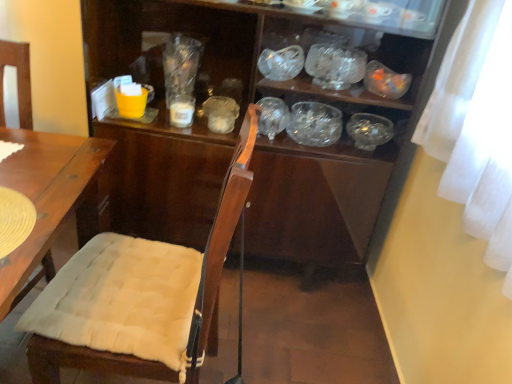
The image size is (512, 384). Describe the element at coordinates (153, 284) in the screenshot. I see `wooden chair cushion at center` at that location.

Describe the element at coordinates (131, 100) in the screenshot. I see `matte yellow cup at upper left, the fourth tableware from the right` at that location.

You are a GUI agent. You are given a task and a screenshot of the screen. Output one action in this format:
    pyautogui.click(x=<x>, y=<y>)
    Task: Click on the transparent plastic cup at upper center
    The image size is (512, 384).
    Given the screenshot: What is the action you would take?
    pyautogui.click(x=180, y=65)

Describe the element at coordinates (314, 124) in the screenshot. This screenshot has width=512, height=384. I see `transparent glass bowl at center, positioned as the 2th glass bowl in top-to-bottom order` at that location.

Where is `transparent glass bowl at upper center, positioned as the 2th glass bowl in bottom-to-top order`? transparent glass bowl at upper center, positioned as the 2th glass bowl in bottom-to-top order is located at coordinates (335, 66).

What do you see at coordinates (335, 66) in the screenshot? I see `transparent glass bowl at upper center, the 1th glass bowl in the top-to-bottom sequence` at bounding box center [335, 66].

Measure the distance between point (356, 130) and camera.

The distance of point (356, 130) from camera is 6.21 feet.

This screenshot has width=512, height=384. Identify the location of wooden chair cushion at center. (153, 284).

Which point is more forward, (292,131) or (183,42)?

The point (292,131) is in front.

Is transparent glass bowl at center, which ranks as the first glass bowl in bottom-to-top order, taller than transparent plastic cup at upper center?

In fact, transparent glass bowl at center, which ranks as the first glass bowl in bottom-to-top order, may be shorter than transparent plastic cup at upper center.

Choose the correct answer: Is transparent glass bowl at center, which ranks as the first glass bowl in bottom-to-top order, inside transparent plastic cup at upper center or outside it?

transparent glass bowl at center, which ranks as the first glass bowl in bottom-to-top order, is not enclosed by transparent plastic cup at upper center.

Is transparent glass bowl at center, positioned as the 2th glass bowl in top-to-bottom order, to the left of transparent plastic cup at upper center from the viewer's perspective?

No.

Based on the photo, from the image's perspective, which object appears higher, matte yellow cup at upper left, the fourth tableware from the right, or transparent glass bowl at center, which ranks as the first glass bowl in bottom-to-top order?

From the image's view, matte yellow cup at upper left, the fourth tableware from the right, is above.

How many degrees apart are the facing directions of matte yellow cup at upper left, which is the first tableware from left to right, and transparent glass bowl at center, which ranks as the first glass bowl in bottom-to-top order?

The angular difference between matte yellow cup at upper left, which is the first tableware from left to right, and transparent glass bowl at center, which ranks as the first glass bowl in bottom-to-top order, is 1.25 degrees.

Is point (115, 85) closer to viewer compared to point (309, 121)?

Yes, point (115, 85) is in front of point (309, 121).

Is matte yellow cup at upper left, which is the first tableware from left to right, beside transparent glass bowl at center, which ranks as the first glass bowl in bottom-to-top order?

They are not placed beside each other.

How many degrees apart are the facing directions of transparent plastic cup at upper center and wooden chair cushion at center?

They differ by 91.7 degrees in their facing directions.

Is transparent plastic cup at upper center not within wooden chair cushion at center?

Absolutely, transparent plastic cup at upper center is external to wooden chair cushion at center.

From a real-world perspective, who is located lower, transparent plastic cup at upper center or wooden chair cushion at center?

wooden chair cushion at center.

Is transparent plastic cup at upper center placed right next to wooden chair cushion at center?

No.

Can you confirm if wooden chair cushion at center is wider than transparent glass bowl at center, the 4th tableware from the left?

Correct, the width of wooden chair cushion at center exceeds that of transparent glass bowl at center, the 4th tableware from the left.

Which of these two, wooden chair cushion at center or transparent glass bowl at center, acting as the first tableware starting from the right, stands taller?

With more height is wooden chair cushion at center.

How different are the orientations of wooden chair cushion at center and transparent glass bowl at center, acting as the first tableware starting from the right, in degrees?

The angular difference between wooden chair cushion at center and transparent glass bowl at center, acting as the first tableware starting from the right, is 89 degrees.

From the picture: From a real-world perspective, who is located higher, wooden chair cushion at center or transparent glass bowl at center, the 4th tableware from the left?

From a 3D spatial view, transparent glass bowl at center, the 4th tableware from the left, is above.

Is white glossy cup at center, the 2th tableware positioned from the left, far away from transparent glass bowl at center, acting as the first tableware starting from the right?

No.

Between white glossy cup at center, the 3th tableware when ordered from right to left, and transparent glass bowl at center, the 4th tableware from the left, which one has smaller width?

white glossy cup at center, the 3th tableware when ordered from right to left.

Is white glossy cup at center, the 3th tableware when ordered from right to left, at the left side of transparent glass bowl at center, acting as the first tableware starting from the right?

Yes.

Is white glossy cup at center, the 2th tableware positioned from the left, inside the boundaries of transparent glass bowl at center, acting as the first tableware starting from the right, or outside?

white glossy cup at center, the 2th tableware positioned from the left, is outside transparent glass bowl at center, acting as the first tableware starting from the right.

Is clear glass bowl at upper center, which is the second tableware from right to left, touching white glossy cup at center, the 3th tableware when ordered from right to left?

They are not placed beside each other.

Is clear glass bowl at upper center, the 3th tableware viewed from the left, not inside white glossy cup at center, the 2th tableware positioned from the left?

Yes.

In the scene shown: Relative to white glossy cup at center, the 3th tableware when ordered from right to left, is clear glass bowl at upper center, which is the second tableware from right to left, in front or behind?

clear glass bowl at upper center, which is the second tableware from right to left, is positioned closer to the viewer than white glossy cup at center, the 3th tableware when ordered from right to left.

Is clear glass bowl at upper center, the 3th tableware viewed from the left, taller or shorter than white glossy cup at center, the 2th tableware positioned from the left?

clear glass bowl at upper center, the 3th tableware viewed from the left, is taller than white glossy cup at center, the 2th tableware positioned from the left.

From the image's perspective, is transparent plastic cup at upper center located above or below clear glass bowl at upper center, which is the second tableware from right to left?

Based on their image positions, transparent plastic cup at upper center is located beneath clear glass bowl at upper center, which is the second tableware from right to left.

Considering the positions of point (167, 64) and point (278, 71), is point (167, 64) closer or farther from the camera than point (278, 71)?

Clearly, point (167, 64) is more distant from the camera than point (278, 71).

How far apart are transparent plastic cup at upper center and clear glass bowl at upper center, the 3th tableware viewed from the left?

They are 14.50 inches apart.

Identify the location of glass jar located underneath the clear glass bowl at upper center, which is the second tableware from right to left (from a real-world perspective). (180, 65).

From the image's perspective, starting from the transparent plastic cup at upper center, which glass bowl is the 2nd one below? Please provide its 2D coordinates.

[(314, 124)]

Identify the location of glass bowl located behind the matte yellow cup at upper left, the fourth tableware from the right. The height and width of the screenshot is (384, 512). (314, 124).

From the image, which object appears to be farther from matte yellow cup at upper left, the fourth tableware from the right, wooden chair cushion at center or transparent plastic cup at upper center?

wooden chair cushion at center is positioned further to the anchor matte yellow cup at upper left, the fourth tableware from the right.

Based on their spatial positions, is wooden chair cushion at center or transparent glass bowl at upper center, the 1th glass bowl in the top-to-bottom sequence, closer to transparent glass bowl at center, the 4th tableware from the left?

transparent glass bowl at upper center, the 1th glass bowl in the top-to-bottom sequence, is closer to transparent glass bowl at center, the 4th tableware from the left.

Considering their positions, is transparent glass bowl at center, which ranks as the first glass bowl in bottom-to-top order, positioned further to transparent glass bowl at upper center, positioned as the 2th glass bowl in bottom-to-top order, than clear glass bowl at upper center, the 3th tableware viewed from the left?

Based on the image, transparent glass bowl at center, which ranks as the first glass bowl in bottom-to-top order, appears to be further to transparent glass bowl at upper center, positioned as the 2th glass bowl in bottom-to-top order.

Which object lies nearer to the anchor point transparent glass bowl at center, which ranks as the first glass bowl in bottom-to-top order, matte yellow cup at upper left, the fourth tableware from the right, or white glossy cup at center, the 3th tableware when ordered from right to left?

white glossy cup at center, the 3th tableware when ordered from right to left, is closer to transparent glass bowl at center, which ranks as the first glass bowl in bottom-to-top order.

Based on their spatial positions, is transparent glass bowl at center, the 4th tableware from the left, or transparent glass bowl at upper center, positioned as the 2th glass bowl in bottom-to-top order, further from transparent plastic cup at upper center?

Among the two, transparent glass bowl at center, the 4th tableware from the left, is located further to transparent plastic cup at upper center.

Consider the image. From the image, which object appears to be nearer to wooden chair cushion at center, transparent glass bowl at center, the 4th tableware from the left, or white glossy cup at center, the 2th tableware positioned from the left?

white glossy cup at center, the 2th tableware positioned from the left, lies closer to wooden chair cushion at center than the other object.

Which object lies nearer to the anchor point transparent glass bowl at center, positioned as the 2th glass bowl in top-to-bottom order, white glossy cup at center, the 2th tableware positioned from the left, or wooden chair cushion at center?

Among the two, white glossy cup at center, the 2th tableware positioned from the left, is located nearer to transparent glass bowl at center, positioned as the 2th glass bowl in top-to-bottom order.

From the image, which object appears to be nearer to transparent plastic cup at upper center, matte yellow cup at upper left, which is the first tableware from left to right, or transparent glass bowl at center, positioned as the 2th glass bowl in top-to-bottom order?

Among the two, matte yellow cup at upper left, which is the first tableware from left to right, is located nearer to transparent plastic cup at upper center.

Locate an element on the screen. glass jar located between matte yellow cup at upper left, which is the first tableware from left to right, and transparent glass bowl at center, positioned as the 2th glass bowl in top-to-bottom order, in the left-right direction is located at coordinates (180, 65).

This screenshot has width=512, height=384. Identify the location of glass jar situated between matte yellow cup at upper left, which is the first tableware from left to right, and transparent glass bowl at upper center, the 1th glass bowl in the top-to-bottom sequence, from left to right. (180, 65).

Find the location of a particular element. The image size is (512, 384). tableware between white glossy cup at center, the 3th tableware when ordered from right to left, and transparent glass bowl at upper center, the 1th glass bowl in the top-to-bottom sequence, in the horizontal direction is located at coordinates (281, 63).

Where is `glass bowl between wooden chair cushion at center and matte yellow cup at upper left, which is the first tableware from left to right, in the front-back direction`? glass bowl between wooden chair cushion at center and matte yellow cup at upper left, which is the first tableware from left to right, in the front-back direction is located at coordinates (335, 66).